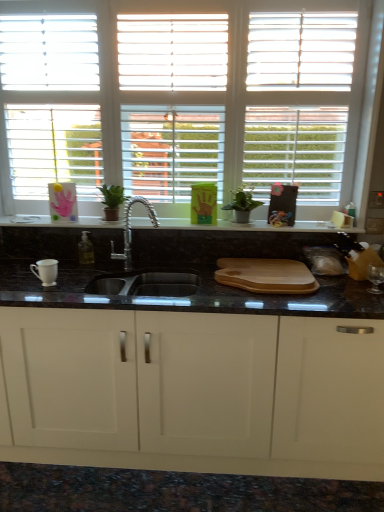
Locate an element on the screen. This screenshot has height=512, width=384. vacant space situated on the left part of polished chrome faucet at center is located at coordinates (94, 275).